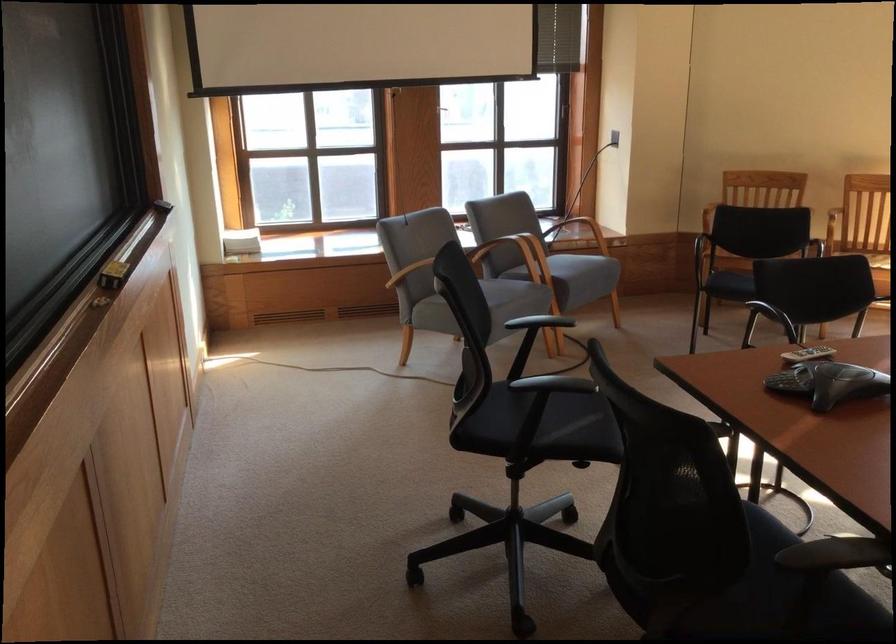
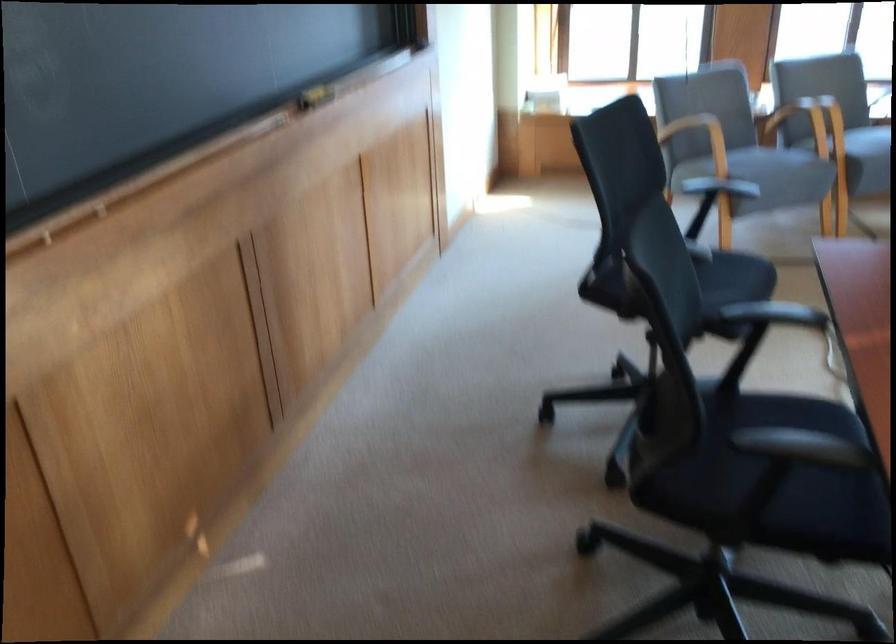
Find the pixel in the second image that matches (504,257) in the first image.

(799, 122)